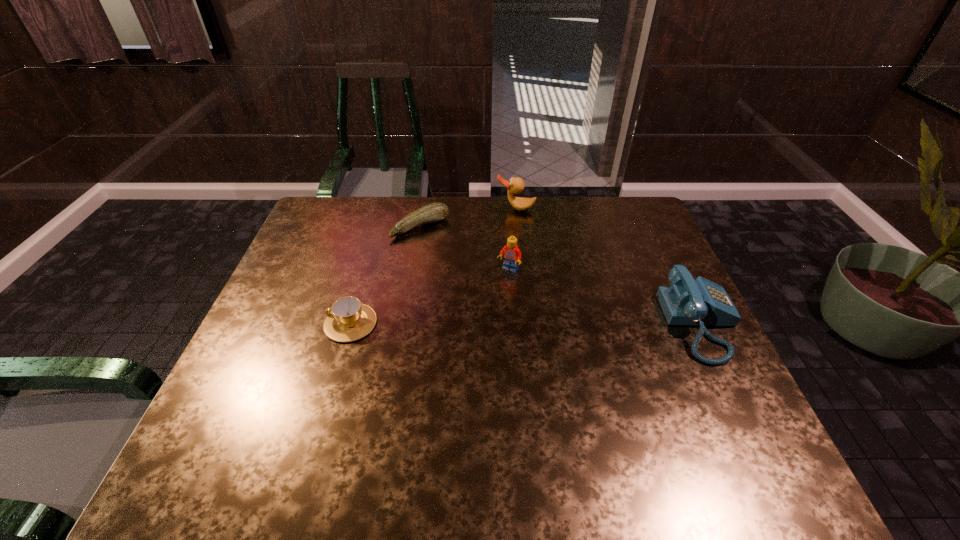
Identify the location of free space on the desktop that is between the cup and the telephone and is positioned on the beak of the duck. The width and height of the screenshot is (960, 540). (492, 323).

Locate an element on the screen. This screenshot has width=960, height=540. free space on the desktop that is between the cup and the rightmost object and is positioned at the stem end of the fourth nearest object is located at coordinates (511, 323).

You are a GUI agent. You are given a task and a screenshot of the screen. Output one action in this format:
    pyautogui.click(x=<x>, y=<y>)
    Task: Click on the vacant spot on the desktop that is between the cup and the telephone and is positioned on the face of the third farthest object
    The image size is (960, 540).
    Given the screenshot: What is the action you would take?
    pyautogui.click(x=474, y=323)